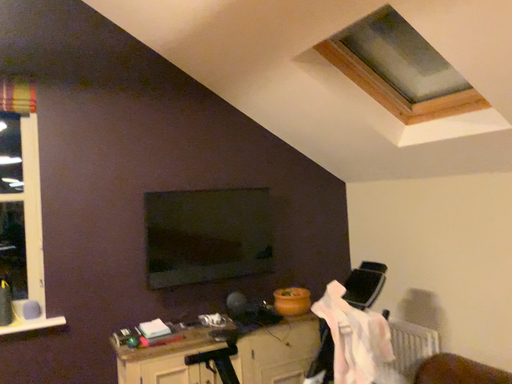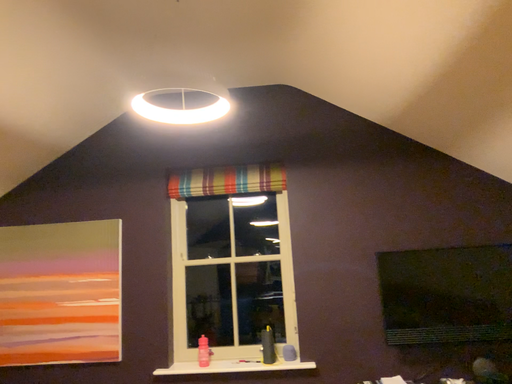
Question: Which way did the camera rotate in the video?

Choices:
 (A) rotated left
 (B) rotated right

Answer: (A)